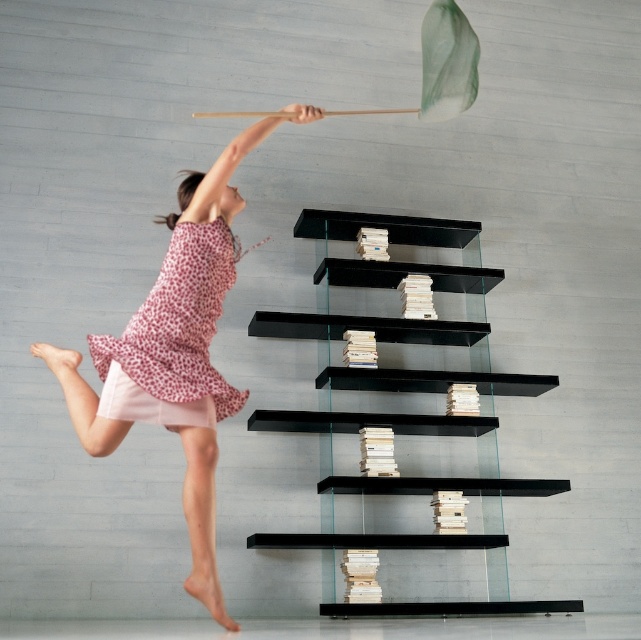
Question: Which of these objects is positioned closest to the black glass shelves at center?

Choices:
 (A) pink dotted dress at upper left
 (B) pink dotted fabric dress at upper left

Answer: (B)

Question: Which object appears closest to the camera in this image?

Choices:
 (A) pink dotted dress at upper left
 (B) black glass shelves at center

Answer: (A)

Question: Can you confirm if pink dotted dress at upper left is wider than pink dotted fabric dress at upper left?

Choices:
 (A) no
 (B) yes

Answer: (B)

Question: Is black glass shelves at center below pink dotted fabric dress at upper left?

Choices:
 (A) no
 (B) yes

Answer: (B)

Question: Estimate the real-world distances between objects in this image. Which object is farther from the black glass shelves at center?

Choices:
 (A) pink dotted dress at upper left
 (B) pink dotted fabric dress at upper left

Answer: (A)

Question: Is black glass shelves at center to the right of pink dotted fabric dress at upper left from the viewer's perspective?

Choices:
 (A) yes
 (B) no

Answer: (A)